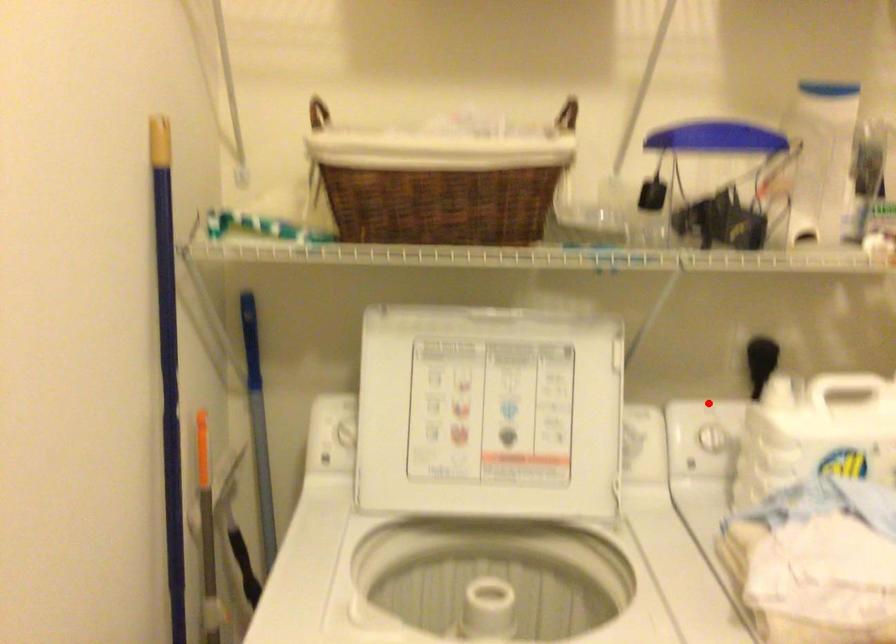
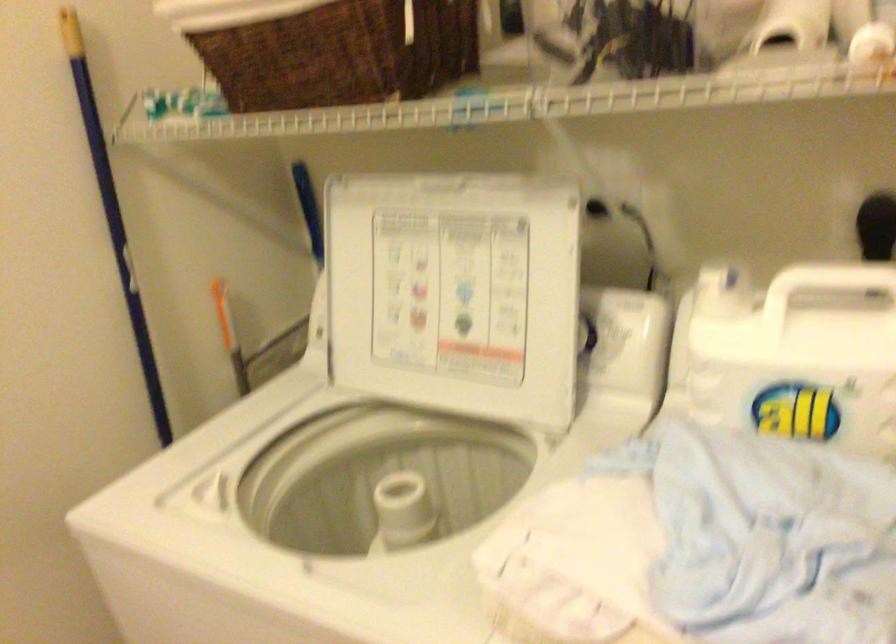
Question: I am providing you with two images of the same scene from different viewpoints. In image1, a red point is highlighted. Considering the same 3D point in image2, which of the following is correct?

Choices:
 (A) It is closer
 (B) It is farther

Answer: (A)